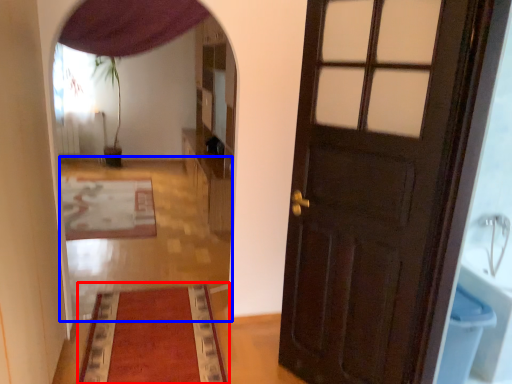
Question: Which point is closer to the camera, mat (highlighted by a red box) or path (highlighted by a blue box)?

Choices:
 (A) mat
 (B) path

Answer: (A)